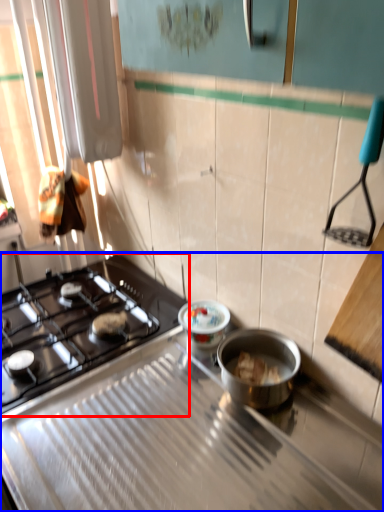
Question: Which of the following is the farthest to the observer, gas stove (highlighted by a red box) or gas stove (highlighted by a blue box)?

Choices:
 (A) gas stove
 (B) gas stove

Answer: (A)